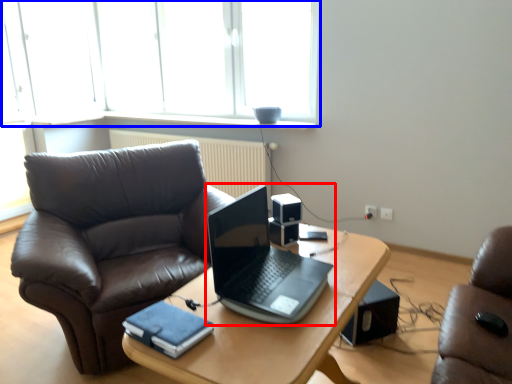
Question: Which object is closer to the camera taking this photo, laptop (highlighted by a red box) or window (highlighted by a blue box)?

Choices:
 (A) laptop
 (B) window

Answer: (A)